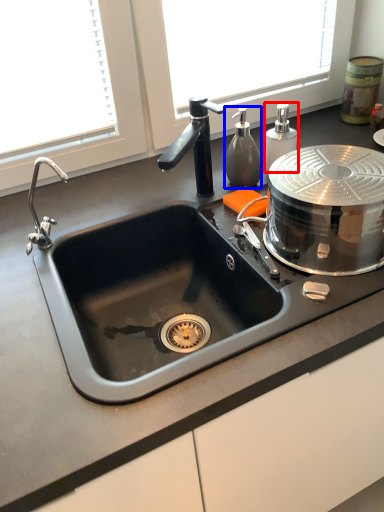
Question: Among these objects, which one is farthest to the camera, soap dispenser (highlighted by a red box) or soap dispenser (highlighted by a blue box)?

Choices:
 (A) soap dispenser
 (B) soap dispenser

Answer: (A)